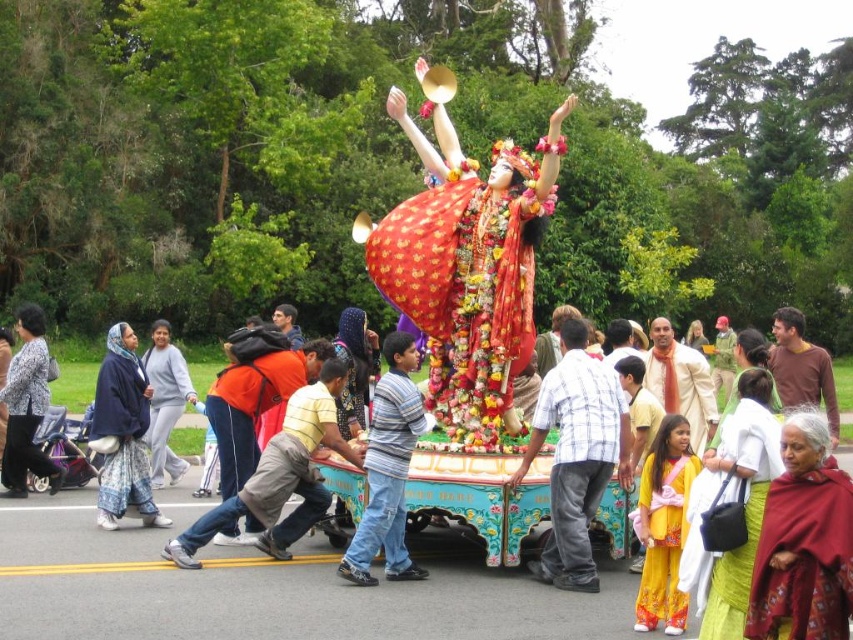
Who is more distant from viewer, (x=270, y=531) or (x=387, y=440)?

Point (x=270, y=531)

Does yellow striped shirt at center have a smaller size compared to striped cotton shirt at center?

Yes.

Which is in front, point (225, 512) or point (376, 394)?

Point (376, 394) is in front.

This screenshot has width=853, height=640. I want to click on yellow striped shirt at center, so click(281, 474).

Does matte black jacket at lower left have a greater height compared to gray sweatshirt at left?

Yes, matte black jacket at lower left is taller than gray sweatshirt at left.

Is point (12, 403) less distant than point (165, 320)?

Yes, point (12, 403) is in front of point (165, 320).

Which is behind, point (28, 372) or point (160, 461)?

The point (160, 461) is more distant.

I want to click on matte black jacket at lower left, so click(x=27, y=406).

How far apart are shiny red fabric at center and striped cotton shirt at center?

shiny red fabric at center is 12.54 feet away from striped cotton shirt at center.

Is point (408, 204) more distant than point (393, 445)?

Yes, point (408, 204) is behind point (393, 445).

Where is `shiny red fabric at center`? This screenshot has height=640, width=853. shiny red fabric at center is located at coordinates (468, 260).